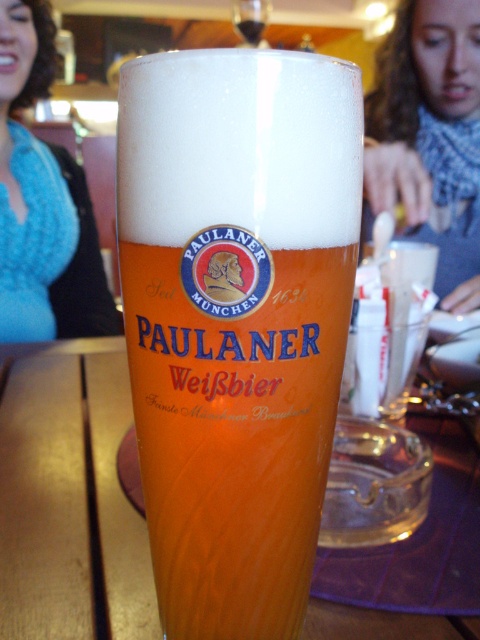
Question: Which of the following is the closest to the observer?

Choices:
 (A) (303, 262)
 (B) (471, 65)
 (C) (40, 188)

Answer: (A)

Question: Is wooden table at center bigger than blue knitted scarf at upper center?

Choices:
 (A) no
 (B) yes

Answer: (A)

Question: Which point is farther to the camera?

Choices:
 (A) wooden table at center
 (B) blue knitted sweater at upper left

Answer: (B)

Question: Where is wooden table at center located in relation to blue knitted scarf at upper center in the image?

Choices:
 (A) below
 (B) above

Answer: (A)

Question: Which point appears farthest from the camera in this image?

Choices:
 (A) (88, 296)
 (B) (226, 390)

Answer: (A)

Question: Does wooden table at center have a lesser width compared to blue knitted sweater at upper left?

Choices:
 (A) no
 (B) yes

Answer: (A)